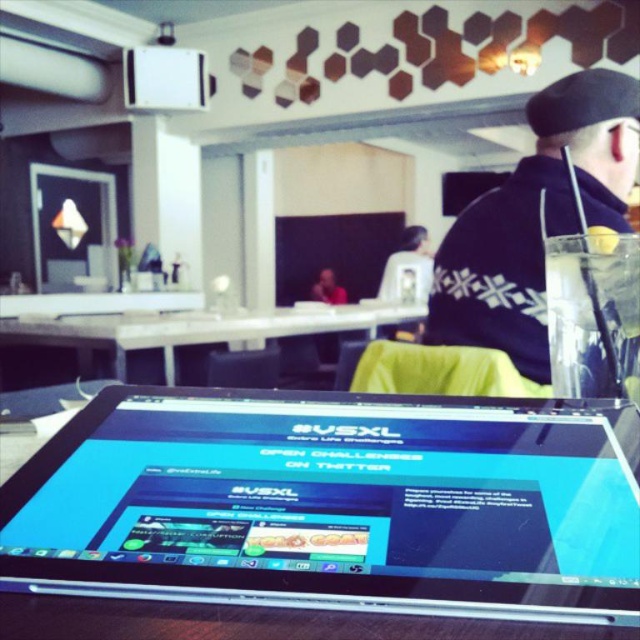
You are standing in the office and want to locate the dark blue sweater at upper right. What are the coordinates where you should look?

The dark blue sweater at upper right is located at coordinates point (536,218).

You are a visitor in the office and want to borrow the silver metallic tablet at center from the person wearing the dark blue sweater at upper right. Can you reach the tablet without moving the person?

The silver metallic tablet at center is to the left of the dark blue sweater at upper right, so you can reach it by approaching from the left side of the person wearing the dark blue sweater at upper right without needing to move them.